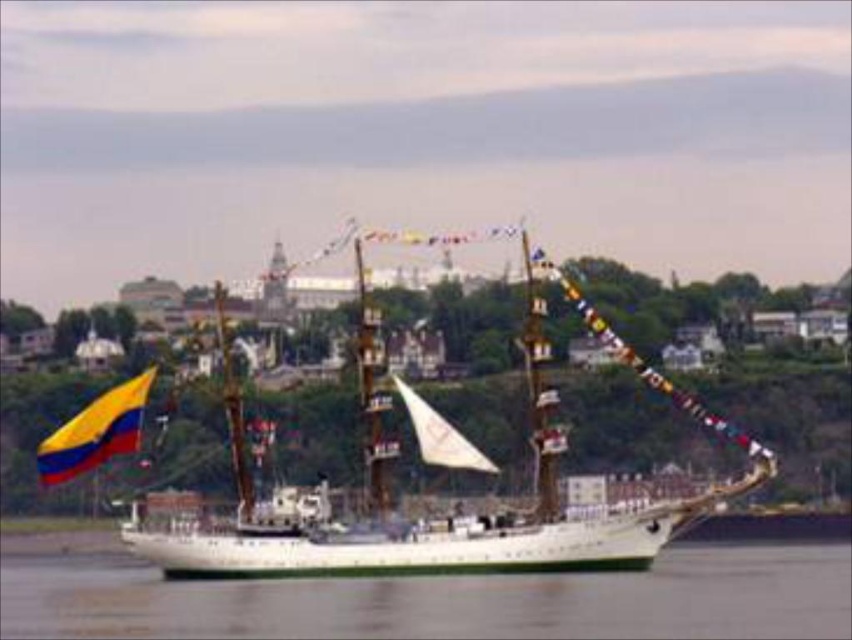
Question: Does white wooden ship at center appear under yellowmaterial/textureflag at left?

Choices:
 (A) yes
 (B) no

Answer: (B)

Question: Estimate the real-world distances between objects in this image. Which object is farther from the white wooden ship at center?

Choices:
 (A) yellowmaterial/textureflag at left
 (B) white water at center

Answer: (A)

Question: Is white water at center to the right of white wooden ship at center from the viewer's perspective?

Choices:
 (A) no
 (B) yes

Answer: (A)

Question: Estimate the real-world distances between objects in this image. Which object is closer to the yellowmaterial/textureflag at left?

Choices:
 (A) white wooden ship at center
 (B) white water at center

Answer: (B)

Question: Which object is positioned farthest from the yellowmaterial/textureflag at left?

Choices:
 (A) white water at center
 (B) white wooden ship at center

Answer: (B)

Question: Is white water at center positioned at the back of yellowmaterial/textureflag at left?

Choices:
 (A) no
 (B) yes

Answer: (A)